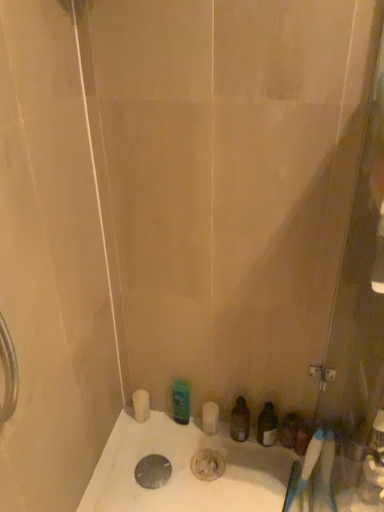
Question: Would you say metallic silver drain at bottom center is to the left or to the right of green matte bottle at center, marked as the third toiletry in a right-to-left arrangement, in the picture?

Choices:
 (A) left
 (B) right

Answer: (A)

Question: Is metallic silver drain at bottom center wider or thinner than green matte bottle at center, marked as the third toiletry in a right-to-left arrangement?

Choices:
 (A) thin
 (B) wide

Answer: (B)

Question: Which object is the farthest from the white plastic toothbrush at lower right?

Choices:
 (A) translucent plastic soap dispenser at lower right, the third toiletry in the left-to-right sequence
 (B) white matte toilet paper at lower left
 (C) green matte bottle at center, marked as the third toiletry in a right-to-left arrangement
 (D) metallic silver drain at bottom center
 (E) translucent plastic bottle at lower center, the second toiletry from the left

Answer: (B)

Question: Estimate the real-world distances between objects in this image. Which object is farther from the white matte toilet paper at lower left?

Choices:
 (A) metallic silver drain at bottom center
 (B) green matte bottle at center, the 1th toiletry in the left-to-right sequence
 (C) translucent plastic soap dispenser at lower right, positioned as the first toiletry in right-to-left order
 (D) translucent plastic bottle at lower center, which appears as the 2th toiletry when viewed from the right
 (E) white plastic toothbrush at lower right

Answer: (E)